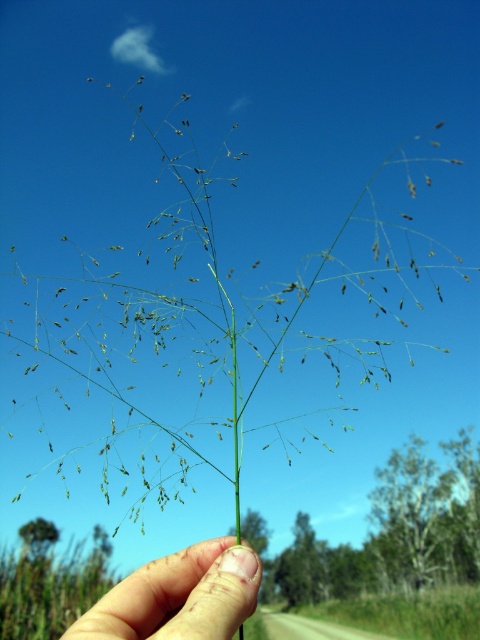
You are holding a plant with your hand positioned at point (144, 636). If you want to place the plant on a table that is 25 inches away from you, will the table be within reach?

The distance between point (144, 636) and the viewer is 26.38 inches. Since the table is 25 inches away, it is slightly closer than the point, so the table would be within reach.

You are a photographer trying to capture the texture of the green matte grass at center without any obstruction. Based on the scene, will the finger nail at center block your view of the grass?

The finger nail at center is positioned over green matte grass at center, so it will block the view of the grass.